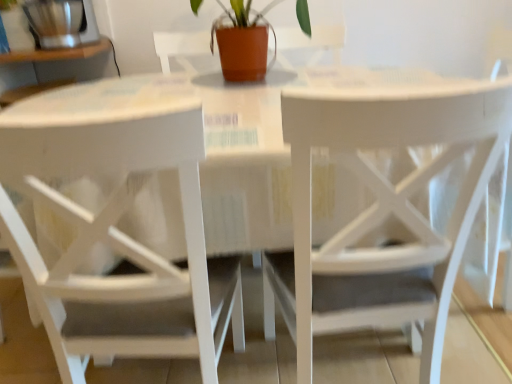
Question: Is white wood chair at center, which appears as the second chair when viewed from the right, located within white matte chair at center, arranged as the first chair when viewed from the right?

Choices:
 (A) no
 (B) yes

Answer: (A)

Question: Is white matte chair at center, arranged as the first chair when viewed from the right, thinner than white wood chair at center, which ranks as the first chair in left-to-right order?

Choices:
 (A) no
 (B) yes

Answer: (A)

Question: Can we say white matte chair at center, arranged as the first chair when viewed from the right, lies outside white wood chair at center, which ranks as the first chair in left-to-right order?

Choices:
 (A) yes
 (B) no

Answer: (A)

Question: Does white matte chair at center, the second chair positioned from the left, turn towards white wood chair at center, which appears as the second chair when viewed from the right?

Choices:
 (A) yes
 (B) no

Answer: (B)

Question: Is white matte chair at center, the second chair positioned from the left, positioned in front of white wood chair at center, which ranks as the first chair in left-to-right order?

Choices:
 (A) yes
 (B) no

Answer: (B)

Question: Is white matte chair at center, the second chair positioned from the left, far from white wood chair at center, which ranks as the first chair in left-to-right order?

Choices:
 (A) no
 (B) yes

Answer: (A)

Question: Considering the relative positions of white matte chair at center, arranged as the first chair when viewed from the right, and terracotta clay pot at center in the image provided, is white matte chair at center, arranged as the first chair when viewed from the right, to the right of terracotta clay pot at center from the viewer's perspective?

Choices:
 (A) yes
 (B) no

Answer: (A)

Question: Are white matte chair at center, arranged as the first chair when viewed from the right, and terracotta clay pot at center located far from each other?

Choices:
 (A) yes
 (B) no

Answer: (B)

Question: From the image's perspective, is white matte chair at center, the second chair positioned from the left, on terracotta clay pot at center?

Choices:
 (A) yes
 (B) no

Answer: (B)

Question: Can you see white matte chair at center, arranged as the first chair when viewed from the right, touching terracotta clay pot at center?

Choices:
 (A) no
 (B) yes

Answer: (A)

Question: From a real-world perspective, is white matte chair at center, the second chair positioned from the left, positioned under terracotta clay pot at center based on gravity?

Choices:
 (A) no
 (B) yes

Answer: (B)

Question: Is white matte chair at center, arranged as the first chair when viewed from the right, behind terracotta clay pot at center?

Choices:
 (A) yes
 (B) no

Answer: (B)

Question: Does white wood chair at center, which appears as the second chair when viewed from the right, appear on the right side of brushed metal coffee grinder at upper left?

Choices:
 (A) no
 (B) yes

Answer: (B)